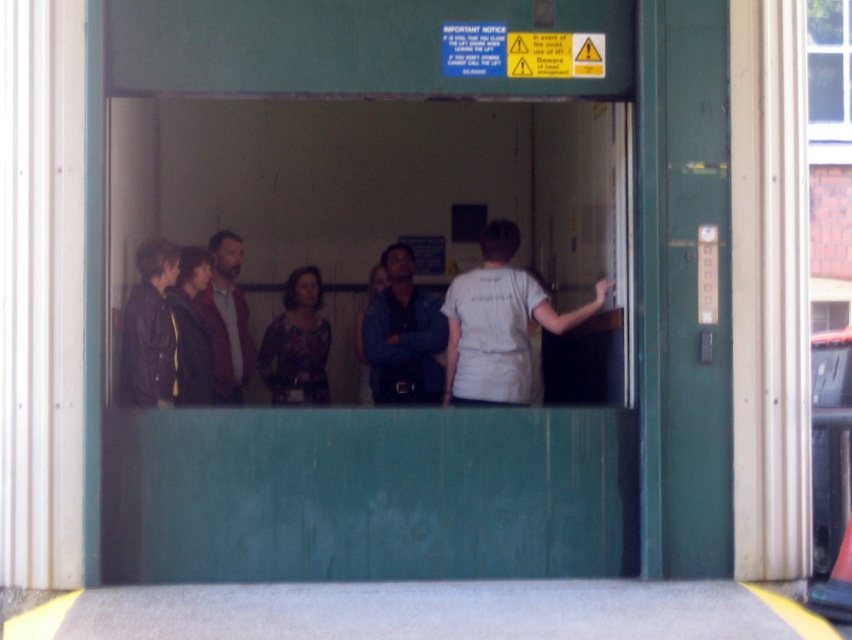
Question: Based on their relative distances, which object is nearer to the green matte door at right?

Choices:
 (A) brown leather jacket at center
 (B) leather jacket at left
 (C) white cotton shirt at center

Answer: (C)

Question: Is green matte door at right further to camera compared to printed fabric blouse at center?

Choices:
 (A) yes
 (B) no

Answer: (B)

Question: Estimate the real-world distances between objects in this image. Which object is closer to the brown leather jacket at center?

Choices:
 (A) blue denim shirt at center
 (B) white cotton shirt at center
 (C) printed fabric blouse at center

Answer: (C)

Question: Based on their relative distances, which object is farther from the brown leather jacket at center?

Choices:
 (A) white cotton shirt at center
 (B) printed fabric blouse at center

Answer: (A)

Question: Is leather jacket at left wider than brown leather jacket at center?

Choices:
 (A) yes
 (B) no

Answer: (B)

Question: Is the position of green matte door at right less distant than that of brown leather jacket at center?

Choices:
 (A) no
 (B) yes

Answer: (B)